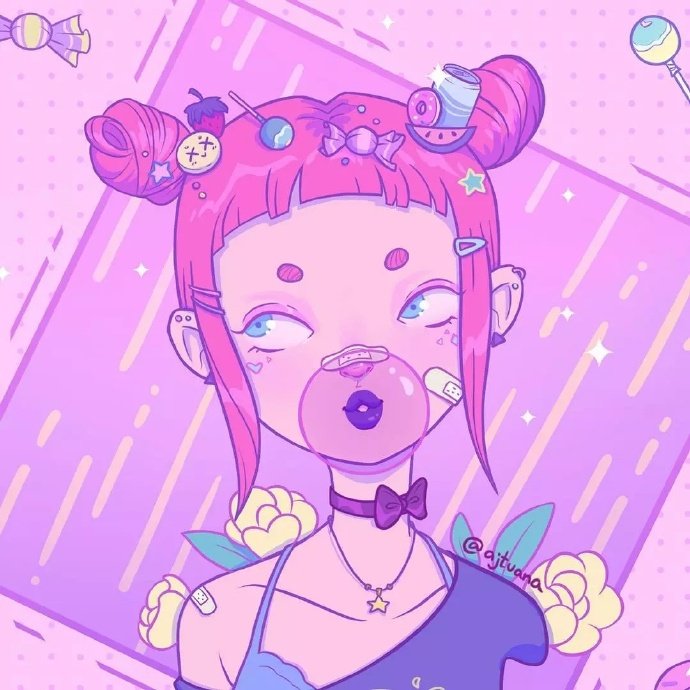
Locate an element on the screen. accessories is located at coordinates (388, 504), (464, 248), (210, 294), (216, 308), (199, 196), (195, 184).